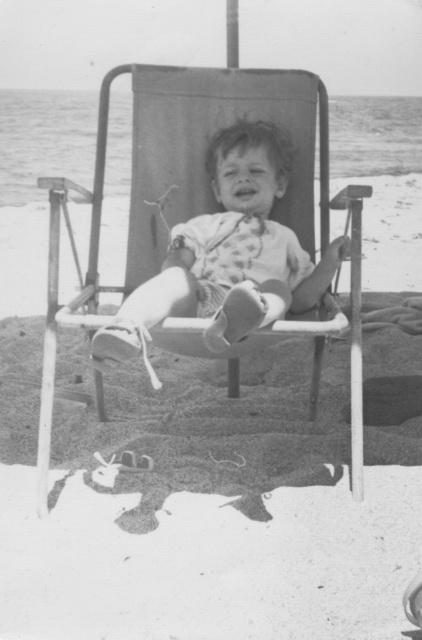
You are planning to set up a small picnic blanket next to the metallic fabric beach chair at center and the matte white toddler at center. Which object requires more space in width to accommodate?

The metallic fabric beach chair at center might be wider than the matte white toddler at center, so it requires more space in width to accommodate.

You are a parent trying to ensure your child stays within a safe area on the beach. The metallic fabric beach chair at center is where you want the matte white toddler at center to stay near. Considering their sizes, can the toddler easily move around the chair without any difficulty?

The metallic fabric beach chair at center is larger in size compared to the matte white toddler at center, so the toddler may have some difficulty moving around the chair due to its bigger size.